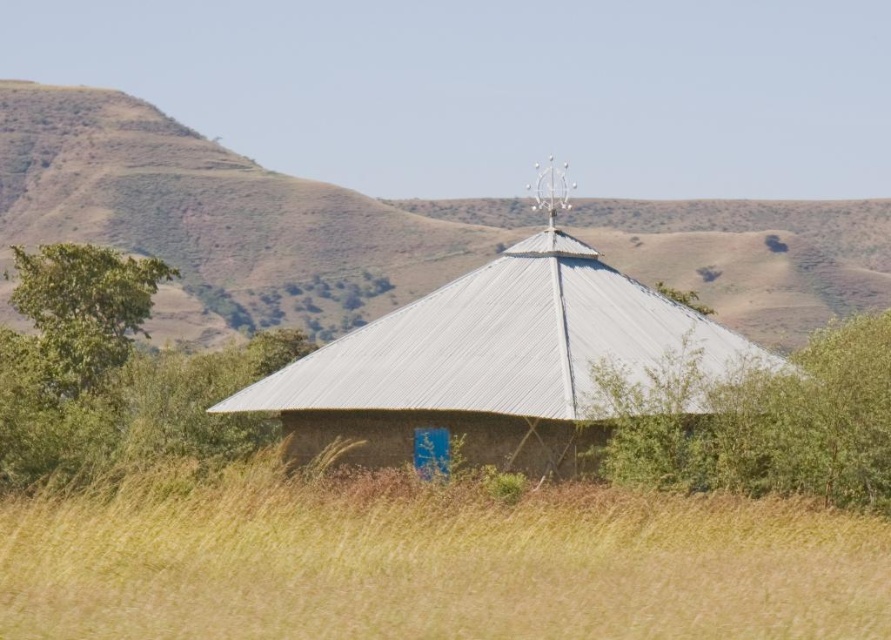
Question: Is green leafy bush at lower right above green leafy tree at left?

Choices:
 (A) no
 (B) yes

Answer: (A)

Question: Is green leafy bush at lower right below green leafy tree at left?

Choices:
 (A) no
 (B) yes

Answer: (B)

Question: Is green leafy bush at lower right smaller than green leafy tree at left?

Choices:
 (A) yes
 (B) no

Answer: (A)

Question: Which point is closer to the camera?

Choices:
 (A) metallic roof at center
 (B) green leafy bush at lower right
 (C) green leafy tree at left

Answer: (B)

Question: Which of the following is the closest to the observer?

Choices:
 (A) green leafy bush at lower right
 (B) green leafy tree at left

Answer: (A)

Question: Among these points, which one is nearest to the camera?

Choices:
 (A) (210, 528)
 (B) (524, 342)
 (C) (78, 275)
 (D) (824, 348)

Answer: (A)